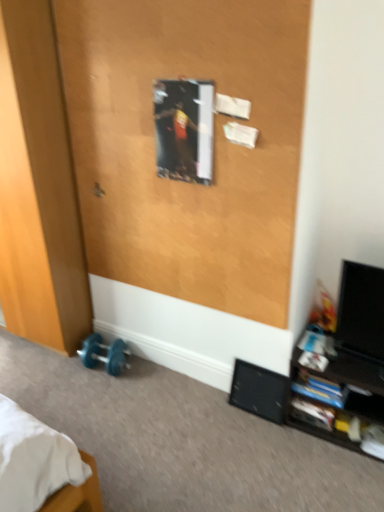
In order to click on vacant area that is in front of blue rubber dumbbell at lower left in this screenshot , I will do `click(95, 393)`.